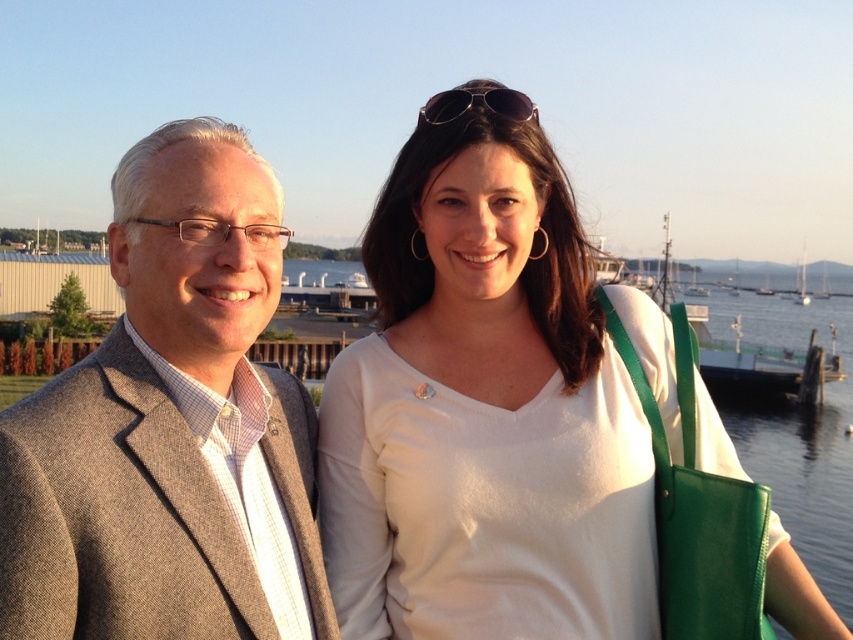
Does white matte shirt at upper right lie behind gray wool suit at left?

Yes, white matte shirt at upper right is further from the viewer.

Between white matte shirt at upper right and gray wool suit at left, which one appears on the left side from the viewer's perspective?

From the viewer's perspective, gray wool suit at left appears more on the left side.

Locate an element on the screen. white matte shirt at upper right is located at coordinates (485, 404).